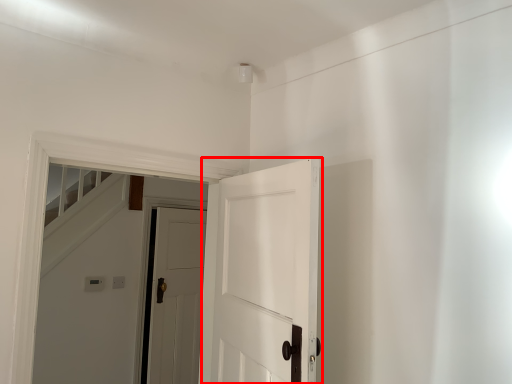
Question: Where is door (annotated by the red box) located in relation to door in the image?

Choices:
 (A) right
 (B) left

Answer: (A)